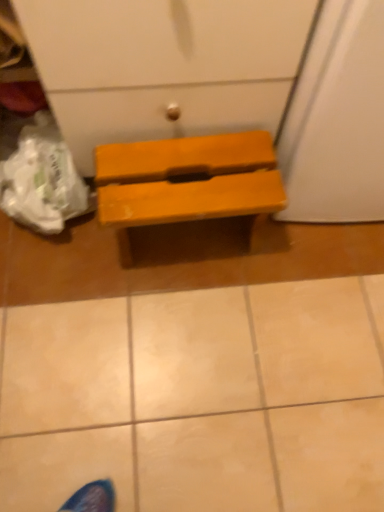
Question: From a real-world perspective, is wooden bench at center above or below matte yellow bench at center?

Choices:
 (A) below
 (B) above

Answer: (A)

Question: Is wooden bench at center inside the boundaries of matte yellow bench at center, or outside?

Choices:
 (A) inside
 (B) outside

Answer: (B)

Question: Considering the positions of point (14, 381) and point (258, 175), is point (14, 381) closer or farther from the camera than point (258, 175)?

Choices:
 (A) farther
 (B) closer

Answer: (A)

Question: In terms of height, does matte yellow bench at center look taller or shorter compared to wooden bench at center?

Choices:
 (A) short
 (B) tall

Answer: (B)

Question: From the image's perspective, is matte yellow bench at center above or below wooden bench at center?

Choices:
 (A) above
 (B) below

Answer: (A)

Question: In terms of width, does matte yellow bench at center look wider or thinner when compared to wooden bench at center?

Choices:
 (A) thin
 (B) wide

Answer: (A)

Question: In terms of size, does matte yellow bench at center appear bigger or smaller than wooden bench at center?

Choices:
 (A) small
 (B) big

Answer: (A)